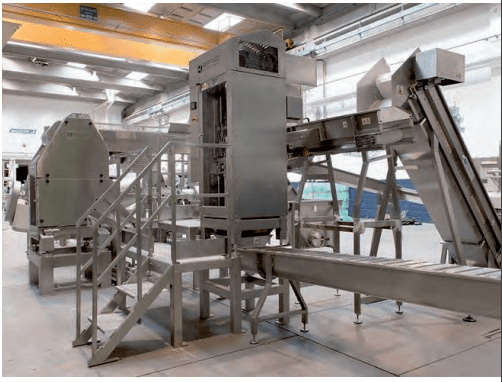
At what (x,y) coordinates should I click in order to perform the action: click on blue wall. Please return your answer as a coordinate pair (x, y). Image resolution: width=502 pixels, height=382 pixels. Looking at the image, I should click on (367, 203), (415, 209), (401, 181), (352, 194), (294, 184).